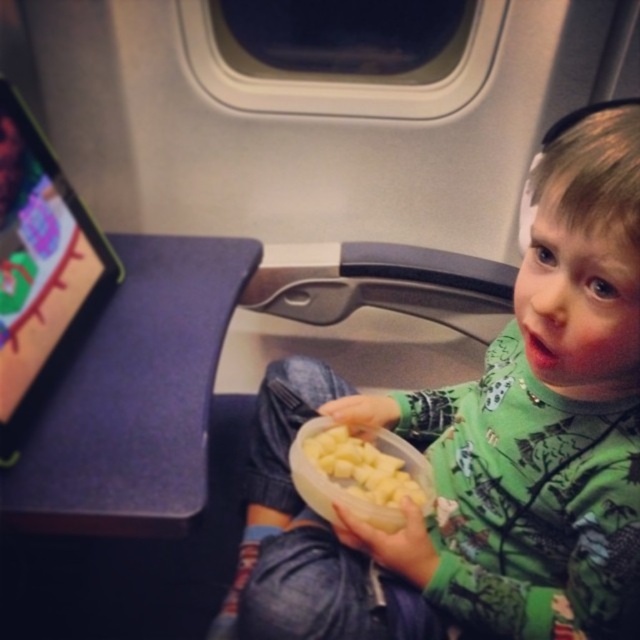
Question: Is green matte shirt at center to the left of yellow matte potato at center from the viewer's perspective?

Choices:
 (A) no
 (B) yes

Answer: (A)

Question: In this image, where is green matte shirt at center located relative to yellow matte potato at center?

Choices:
 (A) below
 (B) above

Answer: (B)

Question: Among these objects, which one is nearest to the camera?

Choices:
 (A) yellow matte potato at center
 (B) green matte shirt at center

Answer: (B)

Question: Can you confirm if green matte shirt at center is smaller than yellow matte potato at center?

Choices:
 (A) no
 (B) yes

Answer: (A)

Question: Which point appears closest to the camera in this image?

Choices:
 (A) (422, 604)
 (B) (308, 432)

Answer: (A)

Question: Which point appears closest to the camera in this image?

Choices:
 (A) (515, 576)
 (B) (328, 428)

Answer: (A)